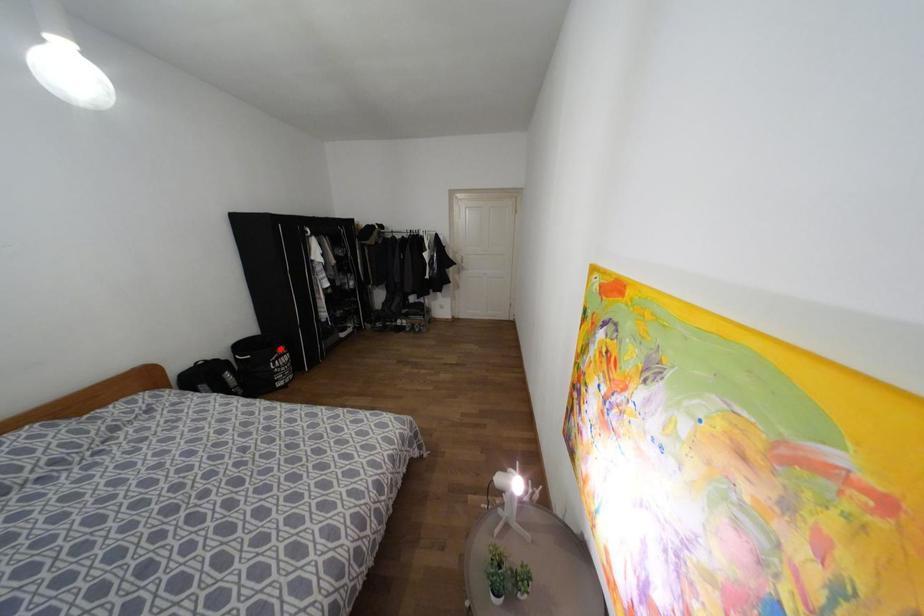
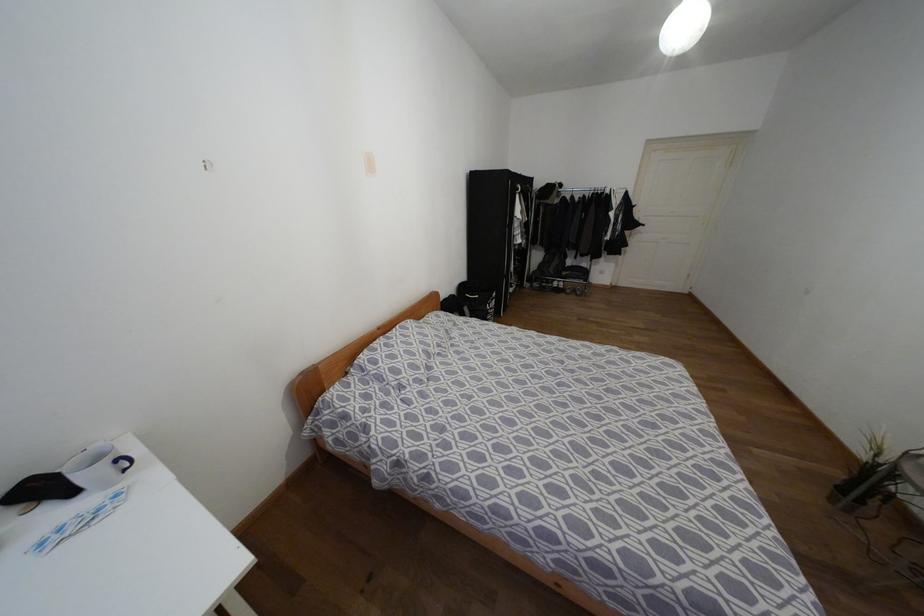
Where in the second image is the point corresponding to the highlighted location from the first image?

(493, 294)